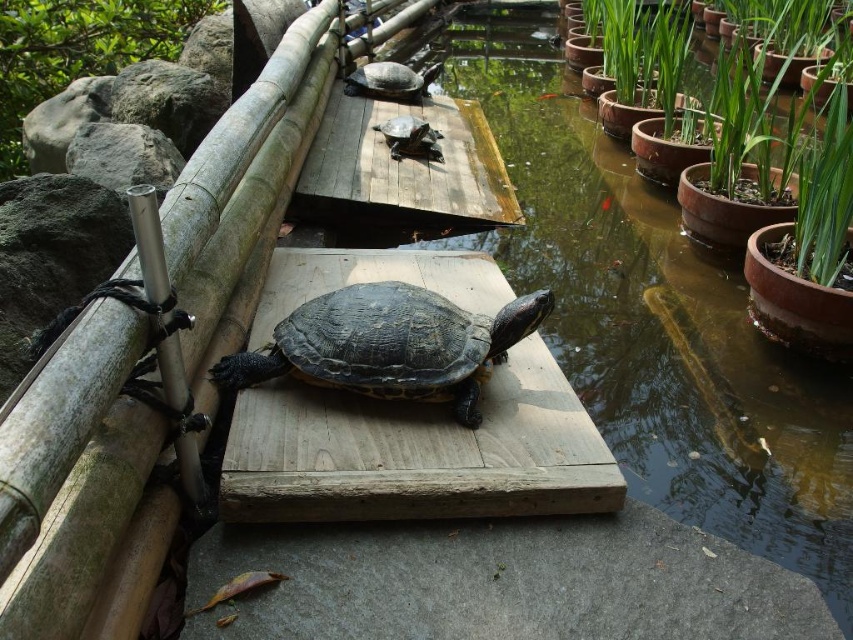
Which of these two, green clay pot at right or shiny brown tortoise at center, stands taller?

Standing taller between the two is green clay pot at right.

Does point (805, 134) come behind point (421, 122)?

Yes.

Image resolution: width=853 pixels, height=640 pixels. I want to click on green clay pot at right, so click(779, 163).

Between brown wooden plank at center and green clay pot at right, which one has less height?

brown wooden plank at center is shorter.

Is brown wooden plank at center closer to the viewer compared to green clay pot at right?

That is True.

I want to click on brown wooden plank at center, so click(419, 452).

Between point (323, 326) and point (7, 68), which one is positioned behind?

Positioned behind is point (7, 68).

Between shiny dark brown tortoise at center and green mossy rock at upper left, which one is positioned lower?

Positioned lower is shiny dark brown tortoise at center.

What do you see at coordinates (389, 344) in the screenshot?
I see `shiny dark brown tortoise at center` at bounding box center [389, 344].

You are a GUI agent. You are given a task and a screenshot of the screen. Output one action in this format:
    pyautogui.click(x=<x>, y=<y>)
    Task: Click on the shiny dark brown tortoise at center
    Image resolution: width=853 pixels, height=640 pixels.
    Given the screenshot: What is the action you would take?
    pyautogui.click(x=389, y=344)